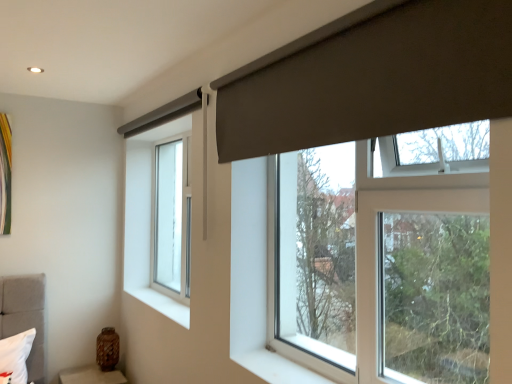
Question: Is the position of brown textured vase at lower left more distant than that of white smooth window sill at lower left?

Choices:
 (A) yes
 (B) no

Answer: (A)

Question: Is brown textured vase at lower left outside white smooth window sill at lower left?

Choices:
 (A) yes
 (B) no

Answer: (A)

Question: Is brown textured vase at lower left not near white smooth window sill at lower left?

Choices:
 (A) yes
 (B) no

Answer: (B)

Question: Does brown textured vase at lower left have a greater width compared to white smooth window sill at lower left?

Choices:
 (A) yes
 (B) no

Answer: (A)

Question: From a real-world perspective, is brown textured vase at lower left below white smooth window sill at lower left?

Choices:
 (A) no
 (B) yes

Answer: (B)

Question: From a real-world perspective, is clear glass window at center left, which appears as the first window when viewed from the back, positioned above or below matte gray curtain at upper right?

Choices:
 (A) above
 (B) below

Answer: (B)

Question: Is clear glass window at center left, positioned as the 2th window in right-to-left order, spatially inside matte gray curtain at upper right, or outside of it?

Choices:
 (A) outside
 (B) inside

Answer: (A)

Question: Considering the positions of clear glass window at center left, the 2th window positioned from the front, and matte gray curtain at upper right in the image, is clear glass window at center left, the 2th window positioned from the front, bigger or smaller than matte gray curtain at upper right?

Choices:
 (A) small
 (B) big

Answer: (B)

Question: Is point (181, 266) positioned closer to the camera than point (489, 117)?

Choices:
 (A) closer
 (B) farther

Answer: (B)

Question: Considering their positions, is brown textured vase at lower left located in front of or behind white smooth window sill at lower left?

Choices:
 (A) behind
 (B) front

Answer: (A)

Question: In terms of height, does brown textured vase at lower left look taller or shorter compared to white smooth window sill at lower left?

Choices:
 (A) tall
 (B) short

Answer: (A)

Question: Choose the correct answer: Is brown textured vase at lower left inside white smooth window sill at lower left or outside it?

Choices:
 (A) inside
 (B) outside

Answer: (B)

Question: Based on their positions, is brown textured vase at lower left located to the left or right of white smooth window sill at lower left?

Choices:
 (A) right
 (B) left

Answer: (B)

Question: Choose the correct answer: Is transparent glass window at center, the 1th window viewed from the front, inside white smooth window sill at lower left or outside it?

Choices:
 (A) inside
 (B) outside

Answer: (B)

Question: Relative to white smooth window sill at lower left, is transparent glass window at center, the second window positioned from the back, in front or behind?

Choices:
 (A) behind
 (B) front

Answer: (B)